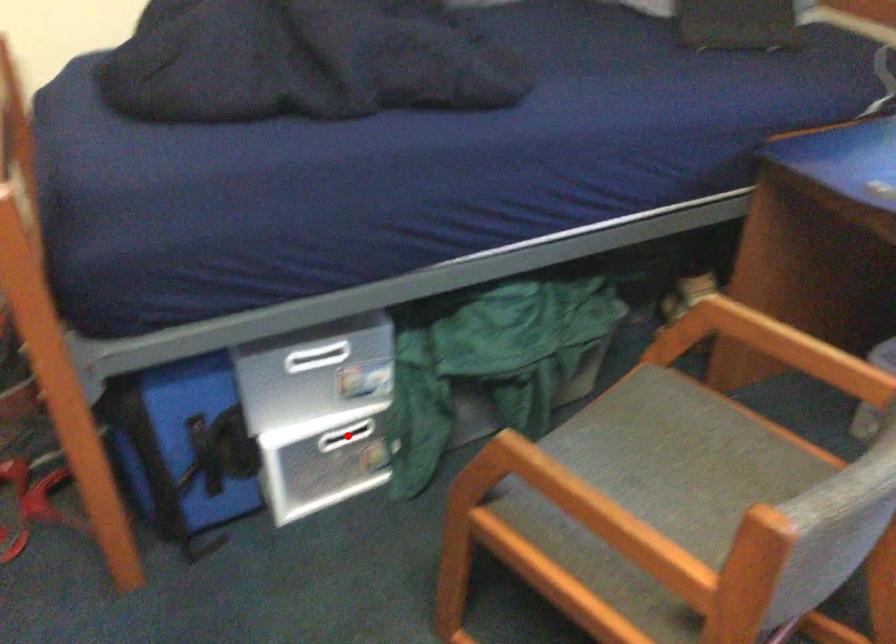
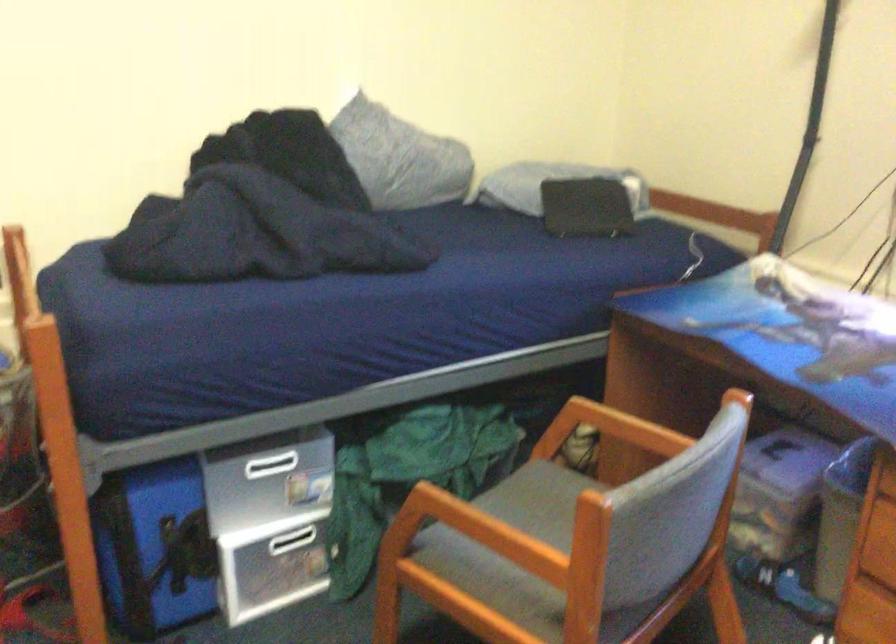
The point at the highlighted location is marked in the first image. Where is the corresponding point in the second image?

(291, 540)